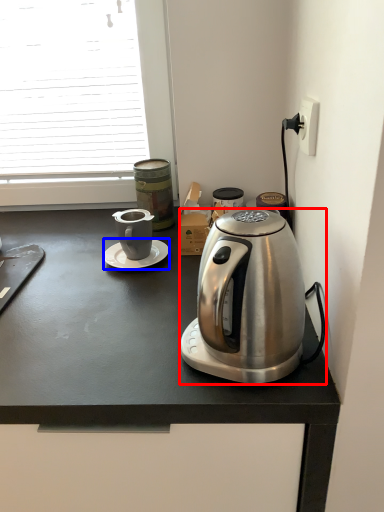
Question: Which object appears closest to the camera in this image, coffee maker (highlighted by a red box) or saucer (highlighted by a blue box)?

Choices:
 (A) coffee maker
 (B) saucer

Answer: (A)